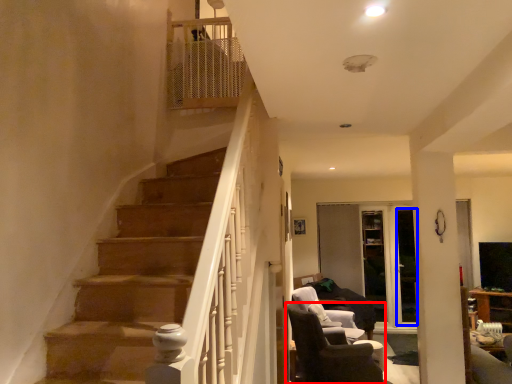
Question: Which object appears closest to the camera in this image, chair (highlighted by a red box) or glass door (highlighted by a blue box)?

Choices:
 (A) chair
 (B) glass door

Answer: (A)